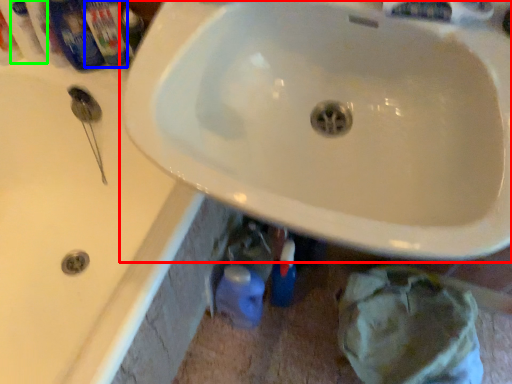
Question: Based on their relative distances, which object is farther from sink (highlighted by a red box)? Choose from toiletry (highlighted by a blue box) and mouthwash (highlighted by a green box).

Choices:
 (A) toiletry
 (B) mouthwash

Answer: (B)